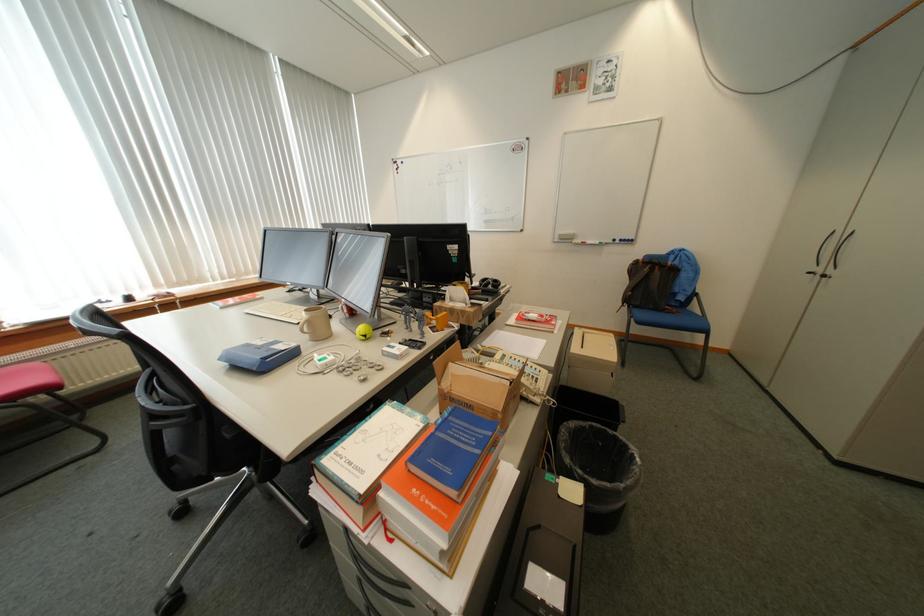
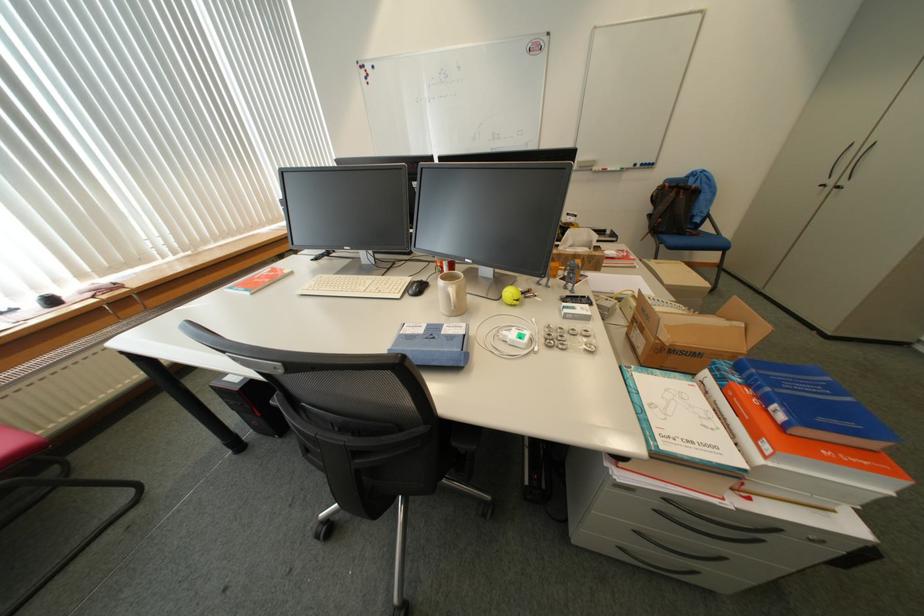
Question: Which direction would the cameraman need to move to produce the second image? Reply with the corresponding letter.

Choices:
 (A) Left
 (B) Right
 (C) Forward
 (D) Backward

Answer: (A)